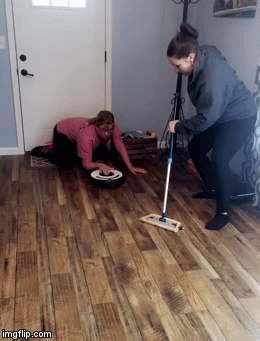
Identify the location of white door. This screenshot has width=260, height=341. (70, 40).